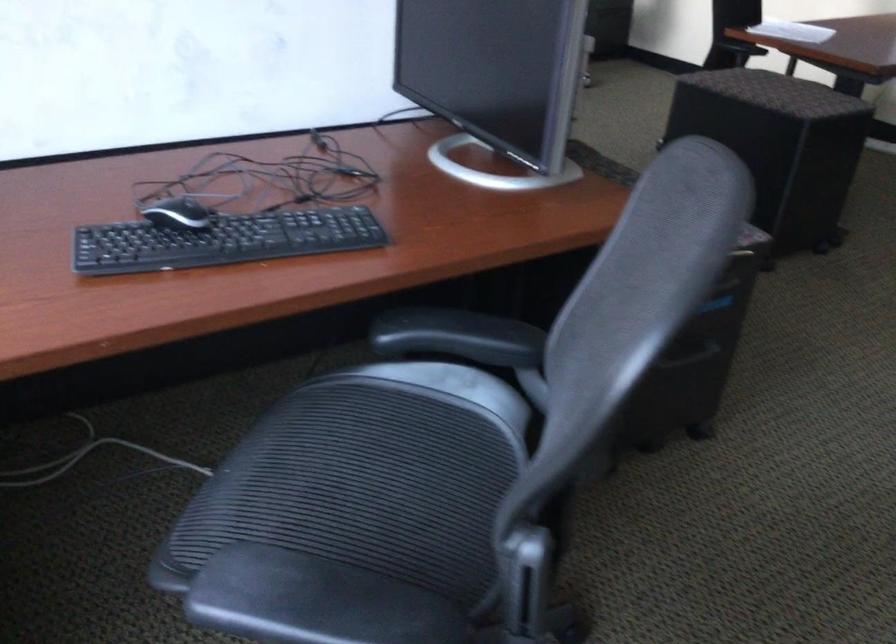
Where is `black keyboard`? The image size is (896, 644). black keyboard is located at coordinates click(x=222, y=240).